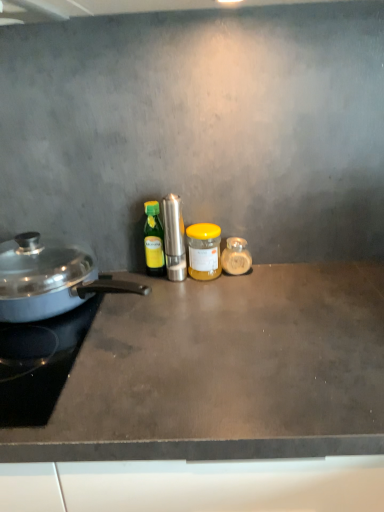
Question: Is yellow matte jar at center, arranged as the 2th kitchen appliance when viewed from the right, outside polished stainless steel grinder at center, which ranks as the 3th kitchen appliance in right-to-left order?

Choices:
 (A) yes
 (B) no

Answer: (A)

Question: Is yellow matte jar at center, arranged as the 2th kitchen appliance when viewed from the right, in contact with polished stainless steel grinder at center, which ranks as the 3th kitchen appliance in right-to-left order?

Choices:
 (A) yes
 (B) no

Answer: (A)

Question: From the image's perspective, is yellow matte jar at center, the fourth kitchen appliance viewed from the left, located above polished stainless steel grinder at center, which ranks as the 3th kitchen appliance in right-to-left order?

Choices:
 (A) no
 (B) yes

Answer: (A)

Question: Considering the relative sizes of yellow matte jar at center, the fourth kitchen appliance viewed from the left, and polished stainless steel grinder at center, which ranks as the 3th kitchen appliance in right-to-left order, in the image provided, is yellow matte jar at center, the fourth kitchen appliance viewed from the left, taller than polished stainless steel grinder at center, which ranks as the 3th kitchen appliance in right-to-left order,?

Choices:
 (A) no
 (B) yes

Answer: (A)

Question: Considering the relative sizes of yellow matte jar at center, arranged as the 2th kitchen appliance when viewed from the right, and polished stainless steel grinder at center, the third kitchen appliance when ordered from left to right, in the image provided, is yellow matte jar at center, arranged as the 2th kitchen appliance when viewed from the right, shorter than polished stainless steel grinder at center, the third kitchen appliance when ordered from left to right,?

Choices:
 (A) no
 (B) yes

Answer: (B)

Question: From their relative heights in the image, would you say green glass bottle at center, marked as the second kitchen appliance in a left-to-right arrangement, is taller or shorter than translucent glass jar at center, the first kitchen appliance when ordered from right to left?

Choices:
 (A) tall
 (B) short

Answer: (A)

Question: Looking at their shapes, would you say green glass bottle at center, positioned as the 4th kitchen appliance in right-to-left order, is wider or thinner than translucent glass jar at center, the first kitchen appliance when ordered from right to left?

Choices:
 (A) wide
 (B) thin

Answer: (B)

Question: From the image's perspective, is green glass bottle at center, marked as the second kitchen appliance in a left-to-right arrangement, positioned above or below translucent glass jar at center, acting as the 5th kitchen appliance starting from the left?

Choices:
 (A) below
 (B) above

Answer: (B)

Question: Looking at the image, does green glass bottle at center, marked as the second kitchen appliance in a left-to-right arrangement, seem bigger or smaller compared to translucent glass jar at center, the first kitchen appliance when ordered from right to left?

Choices:
 (A) big
 (B) small

Answer: (A)

Question: Considering the positions of translucent glass jar at center, acting as the 5th kitchen appliance starting from the left, and green glass bottle at center, marked as the second kitchen appliance in a left-to-right arrangement, in the image, is translucent glass jar at center, acting as the 5th kitchen appliance starting from the left, bigger or smaller than green glass bottle at center, marked as the second kitchen appliance in a left-to-right arrangement,?

Choices:
 (A) big
 (B) small

Answer: (B)

Question: In terms of height, does translucent glass jar at center, acting as the 5th kitchen appliance starting from the left, look taller or shorter compared to green glass bottle at center, positioned as the 4th kitchen appliance in right-to-left order?

Choices:
 (A) tall
 (B) short

Answer: (B)

Question: In terms of width, does translucent glass jar at center, the first kitchen appliance when ordered from right to left, look wider or thinner when compared to green glass bottle at center, positioned as the 4th kitchen appliance in right-to-left order?

Choices:
 (A) thin
 (B) wide

Answer: (B)

Question: Visually, is translucent glass jar at center, the first kitchen appliance when ordered from right to left, positioned to the left or to the right of green glass bottle at center, positioned as the 4th kitchen appliance in right-to-left order?

Choices:
 (A) left
 (B) right

Answer: (B)

Question: Is dark gray concrete countertop at center wider or thinner than polished stainless steel grinder at center, the third kitchen appliance when ordered from left to right?

Choices:
 (A) wide
 (B) thin

Answer: (A)

Question: Is dark gray concrete countertop at center in front of or behind polished stainless steel grinder at center, the third kitchen appliance when ordered from left to right, in the image?

Choices:
 (A) behind
 (B) front

Answer: (B)